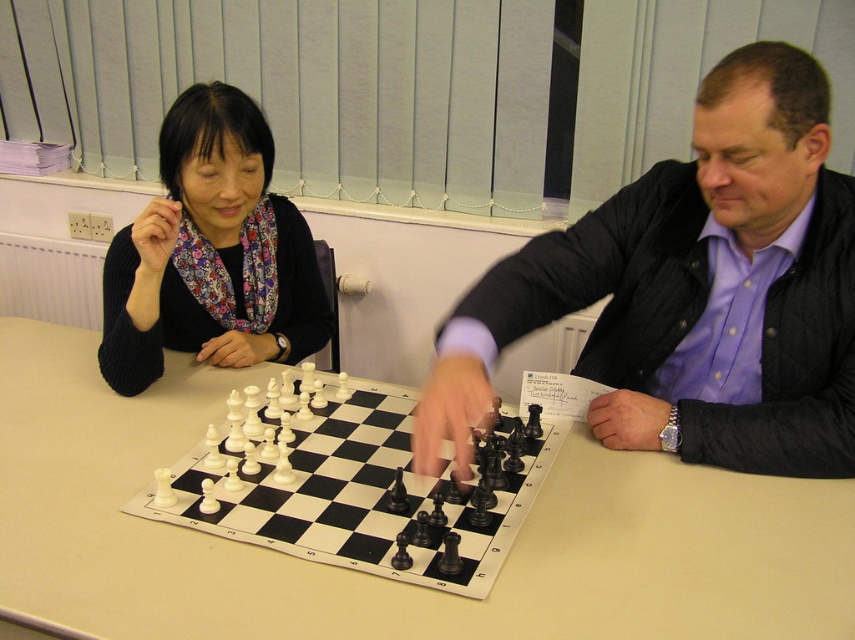
Based on the photo, you are standing at the entrance of the room and want to place a small vase on the table between the two chess players. The coordinates for the vase placement must be exactly at point 0.5, 0.5. Is the point 0.5, 0.5 available for placing the vase without overlapping the matte black jacket at center?

The matte black jacket at center is located at point (x=693, y=292), which is not at (x=427, y=320). Therefore, the point (x=427, y=320) is available for placing the vase without overlapping the matte black jacket at center.

You are a delivery person who needs to place a small package between the white plastic table at center and the matte black jacket at center. The package is 14 inches long. Can you fit it between them without moving either object?

The distance between the white plastic table at center and the matte black jacket at center is 13.79 inches, which is shorter than the 14 inch package. Therefore, the package cannot fit between them without moving either object.

You are a delivery person who needs to place a rectangular box that measures 12 inches in length and 10 inches in width on the white plastic table at center. Can the box fit on the table without hanging over the edges?

The distance of white plastic table at center from camera is 36.06 inches. The box measures 12 inches in length and 10 inches in width. Since the table is 36.06 inches away from the camera, it is unclear whether the table has enough surface area to accommodate the box. The provided information does not specify the table dimensions, so we cannot determine if the box will fit based on the given data.